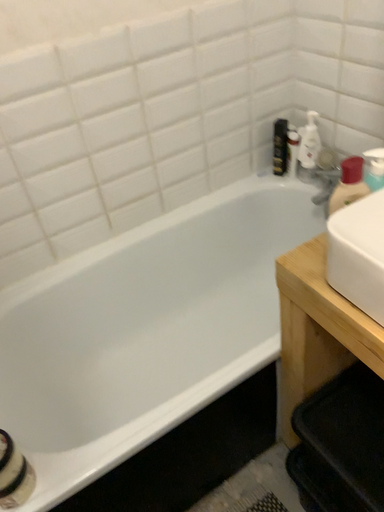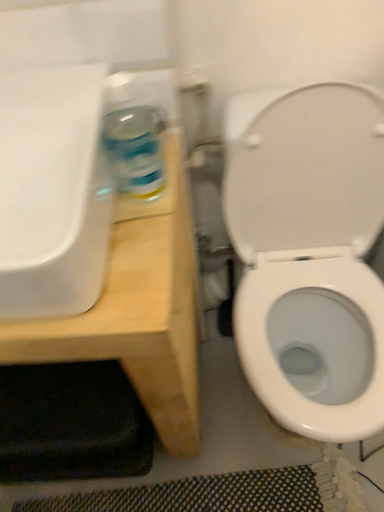
Question: How did the camera likely rotate when shooting the video?

Choices:
 (A) rotated right
 (B) rotated left

Answer: (A)